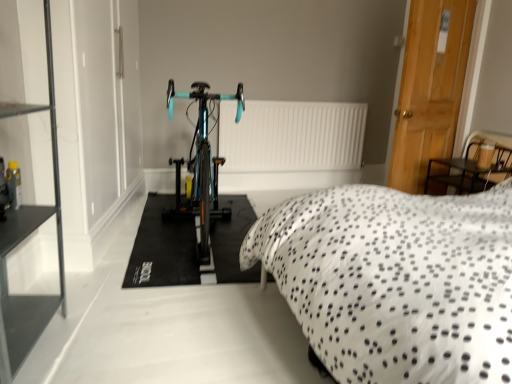
Identify the location of white dotted fabric at center. Image resolution: width=512 pixels, height=384 pixels. (395, 281).

At what (x,y) coordinates should I click in order to perform the action: click on white matte radiator at center. Please return your answer as a coordinate pair (x, y). Looking at the image, I should click on [292, 136].

Describe the element at coordinates (163, 248) in the screenshot. I see `teal glossy bicycle at center` at that location.

This screenshot has width=512, height=384. I want to click on white dotted fabric at center, so click(x=395, y=281).

Is point (386, 296) closer to camera compared to point (19, 303)?

Yes, it is.

Based on the photo, is white dotted fabric at center inside the boundaries of black glass shelf at left, or outside?

white dotted fabric at center cannot be found inside black glass shelf at left.

Considering the positions of objects white dotted fabric at center and black glass shelf at left in the image provided, who is more to the right, white dotted fabric at center or black glass shelf at left?

white dotted fabric at center.

Is the surface of white dotted fabric at center in direct contact with black glass shelf at left?

No, white dotted fabric at center is not next to black glass shelf at left.

Is teal glossy bicycle at center facing away from black glass shelf at left?

No.

Between teal glossy bicycle at center and black glass shelf at left, which one has smaller width?

Thinner between the two is black glass shelf at left.

Considering the positions of objects teal glossy bicycle at center and black glass shelf at left in the image provided, who is more to the left, teal glossy bicycle at center or black glass shelf at left?

From the viewer's perspective, black glass shelf at left appears more on the left side.

From a real-world perspective, who is located higher, teal glossy bicycle at center or black glass shelf at left?

black glass shelf at left.

Based on the photo, can you confirm if black glass shelf at left is bigger than teal glossy bicycle at center?

Correct, black glass shelf at left is larger in size than teal glossy bicycle at center.

Does point (51, 112) appear closer or farther from the camera than point (143, 240)?

Point (51, 112) is closer to the camera than point (143, 240).

From the image's perspective, between black glass shelf at left and teal glossy bicycle at center, who is located below?

teal glossy bicycle at center is shown below in the image.

Is black glass shelf at left taller or shorter than teal glossy bicycle at center?

Considering their sizes, black glass shelf at left has more height than teal glossy bicycle at center.

Which is more to the left, white matte radiator at center or black glass shelf at left?

From the viewer's perspective, black glass shelf at left appears more on the left side.

Is white matte radiator at center oriented away from black glass shelf at left?

No, white matte radiator at center's orientation is not away from black glass shelf at left.

Is white matte radiator at center far away from black glass shelf at left?

Absolutely, white matte radiator at center is distant from black glass shelf at left.

Consider the image. How far apart are white matte radiator at center and black glass shelf at left?

white matte radiator at center and black glass shelf at left are 8.70 feet apart.

From the picture: From the image's perspective, relative to teal glossy bicycle at center, is teal glossy bicycle at center above or below?

teal glossy bicycle at center is situated higher than teal glossy bicycle at center in the image.

Considering their positions, is teal glossy bicycle at center located in front of or behind teal glossy bicycle at center?

In the image, teal glossy bicycle at center appears in front of teal glossy bicycle at center.

From a real-world perspective, is teal glossy bicycle at center on top of teal glossy bicycle at center?

Correct, in the physical world, teal glossy bicycle at center is higher than teal glossy bicycle at center.

The width and height of the screenshot is (512, 384). I want to click on flat that appears below the teal glossy bicycle at center (from a real-world perspective), so click(163, 248).

Who is more distant, white dotted fabric at center or white matte radiator at center?

white matte radiator at center is further from the camera.

Is point (362, 349) farther from camera compared to point (302, 168)?

No.

Considering the sizes of objects white dotted fabric at center and white matte radiator at center in the image provided, who is taller, white dotted fabric at center or white matte radiator at center?

Standing taller between the two is white dotted fabric at center.

Is teal glossy bicycle at center outside of white dotted fabric at center?

teal glossy bicycle at center is positioned outside white dotted fabric at center.

How distant is teal glossy bicycle at center from white dotted fabric at center?

35.21 inches.

Is white dotted fabric at center at the back of teal glossy bicycle at center?

No, white dotted fabric at center is not at the back of teal glossy bicycle at center.

From the image's perspective, relative to white dotted fabric at center, is teal glossy bicycle at center above or below?

teal glossy bicycle at center is situated lower than white dotted fabric at center in the image.

Identify the location of shelf to the left of white dotted fabric at center. This screenshot has width=512, height=384. (23, 239).

In order to click on bicycle below the black glass shelf at left (from a real-world perspective) in this screenshot , I will do `click(201, 165)`.

Looking at this image, which object lies nearer to the anchor point white dotted fabric at center, black glass shelf at left or wooden door at right?

black glass shelf at left is positioned closer to the anchor white dotted fabric at center.

Estimate the real-world distances between objects in this image. Which object is closer to white matte radiator at center, teal glossy bicycle at center or black glass shelf at left?

teal glossy bicycle at center is positioned closer to the anchor white matte radiator at center.

Looking at the image, which one is located closer to wooden door at right, teal glossy bicycle at center or black glass shelf at left?

teal glossy bicycle at center.

In the scene shown: Based on their spatial positions, is wooden door at right or white dotted fabric at center further from teal glossy bicycle at center?

wooden door at right is positioned further to the anchor teal glossy bicycle at center.

Considering their positions, is teal glossy bicycle at center positioned closer to wooden door at right than teal glossy bicycle at center?

teal glossy bicycle at center is closer to wooden door at right.

From the image, which object appears to be farther from black glass shelf at left, teal glossy bicycle at center or white matte radiator at center?

Among the two, white matte radiator at center is located further to black glass shelf at left.

Estimate the real-world distances between objects in this image. Which object is closer to white dotted fabric at center, white matte radiator at center or teal glossy bicycle at center?

teal glossy bicycle at center lies closer to white dotted fabric at center than the other object.

Estimate the real-world distances between objects in this image. Which object is closer to teal glossy bicycle at center, teal glossy bicycle at center or black glass shelf at left?

teal glossy bicycle at center lies closer to teal glossy bicycle at center than the other object.

Find the location of `flat between white dotted fabric at center and wooden door at right from front to back`. flat between white dotted fabric at center and wooden door at right from front to back is located at coordinates (163, 248).

At what (x,y) coordinates should I click in order to perform the action: click on bed situated between black glass shelf at left and wooden door at right from left to right. Please return your answer as a coordinate pair (x, y). This screenshot has height=384, width=512. Looking at the image, I should click on (395, 281).

Where is `flat located between white dotted fabric at center and white matte radiator at center in the depth direction`? flat located between white dotted fabric at center and white matte radiator at center in the depth direction is located at coordinates (163, 248).

This screenshot has height=384, width=512. What are the coordinates of `bicycle positioned between white dotted fabric at center and teal glossy bicycle at center from near to far` in the screenshot? It's located at (201, 165).